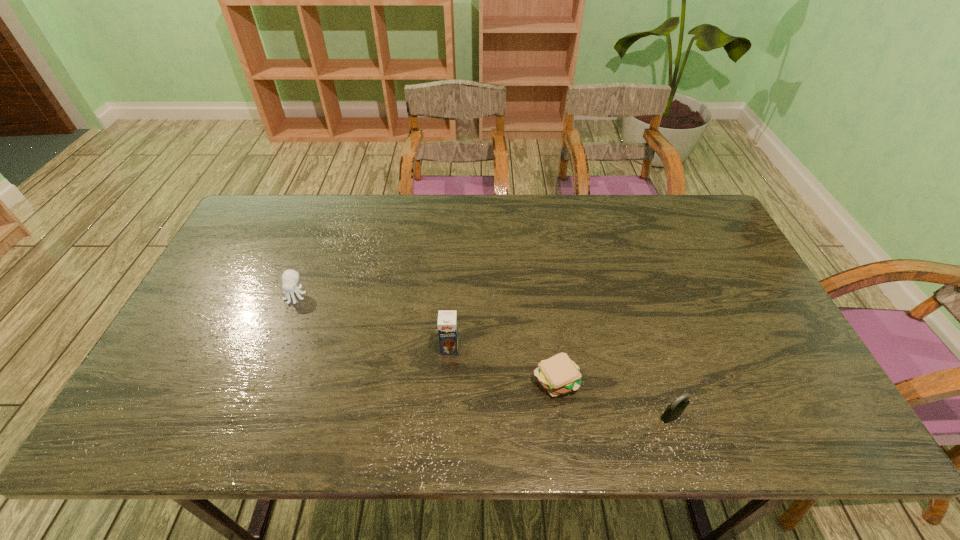
The image size is (960, 540). I want to click on unoccupied position between the chocolate milk and the shortest object, so click(x=503, y=363).

Where is `vacant space that's between the rightmost object and the third object from left to right`? Image resolution: width=960 pixels, height=540 pixels. vacant space that's between the rightmost object and the third object from left to right is located at coordinates (613, 397).

This screenshot has height=540, width=960. In order to click on unoccupied area between the leftmost object and the second farthest object in this screenshot , I will do coord(372,322).

You are a GUI agent. You are given a task and a screenshot of the screen. Output one action in this format:
    pyautogui.click(x=<x>, y=<y>)
    Task: Click on the empty location between the third nearest object and the third farthest object
    This screenshot has height=540, width=960.
    Given the screenshot: What is the action you would take?
    pyautogui.click(x=503, y=363)

The height and width of the screenshot is (540, 960). What are the coordinates of `empty space that is in between the patty and the nearest object` in the screenshot? It's located at (613, 397).

Where is `vacant area between the leftmost object and the second object from right to left`? The image size is (960, 540). vacant area between the leftmost object and the second object from right to left is located at coordinates (425, 337).

The image size is (960, 540). In order to click on object that stands as the third closest to the padlock in this screenshot , I will do `click(290, 278)`.

This screenshot has height=540, width=960. In order to click on the third closest object to the third object from left to right in this screenshot , I will do `click(290, 278)`.

I want to click on vacant area that satisfies the following two spatial constraints: 1. on the front-facing side of the octopus; 2. on the left side of the rightmost object, so click(249, 416).

The height and width of the screenshot is (540, 960). What are the coordinates of `blank space that satisfies the following two spatial constraints: 1. on the front-facing side of the octopus; 2. on the right side of the shortest object` in the screenshot? It's located at (263, 379).